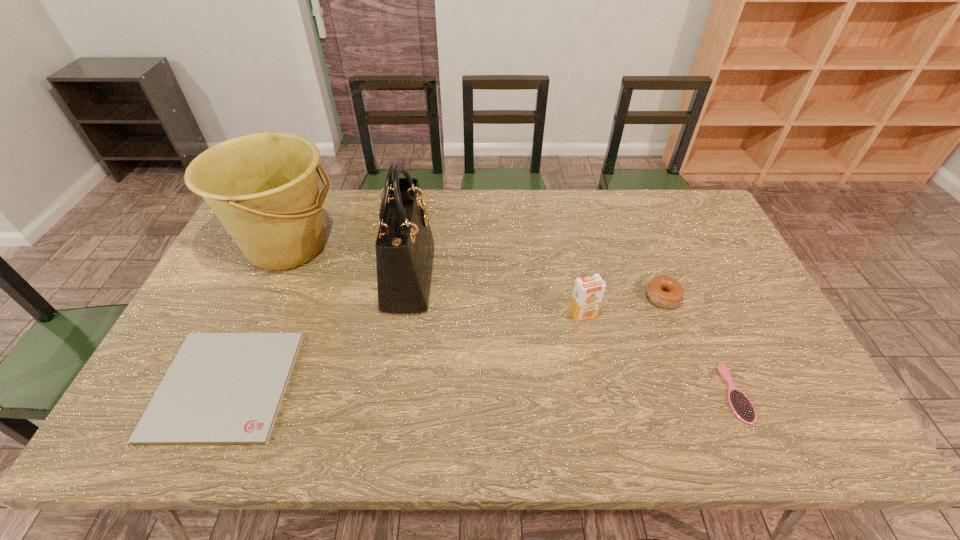
This screenshot has width=960, height=540. What are the coordinates of `the tallest object` in the screenshot? It's located at (404, 246).

At what (x,y) coordinates should I click in order to perform the action: click on handbag. Please return your answer as a coordinate pair (x, y). Image resolution: width=960 pixels, height=540 pixels. Looking at the image, I should click on (404, 246).

The height and width of the screenshot is (540, 960). Find the location of `bucket`. bucket is located at coordinates (263, 187).

Where is `orange juice`? orange juice is located at coordinates (588, 292).

Find the location of a particular element. The width and height of the screenshot is (960, 540). the third tallest object is located at coordinates (588, 292).

At what (x,y) coordinates should I click in order to perform the action: click on the fourth tallest object. Please return your answer as a coordinate pair (x, y). Looking at the image, I should click on (665, 292).

Locate an element on the screen. The height and width of the screenshot is (540, 960). bagel is located at coordinates (665, 292).

The width and height of the screenshot is (960, 540). I want to click on hairbrush, so click(740, 404).

I want to click on the rightmost object, so click(x=740, y=404).

Where is `the shortest object`? The width and height of the screenshot is (960, 540). the shortest object is located at coordinates (222, 388).